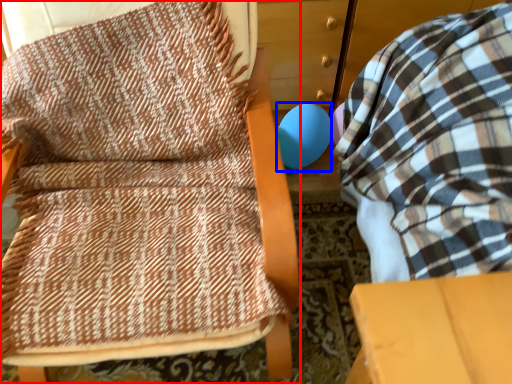
Question: Which point is further to the camera, furniture (highlighted by a red box) or balloon (highlighted by a blue box)?

Choices:
 (A) furniture
 (B) balloon

Answer: (B)